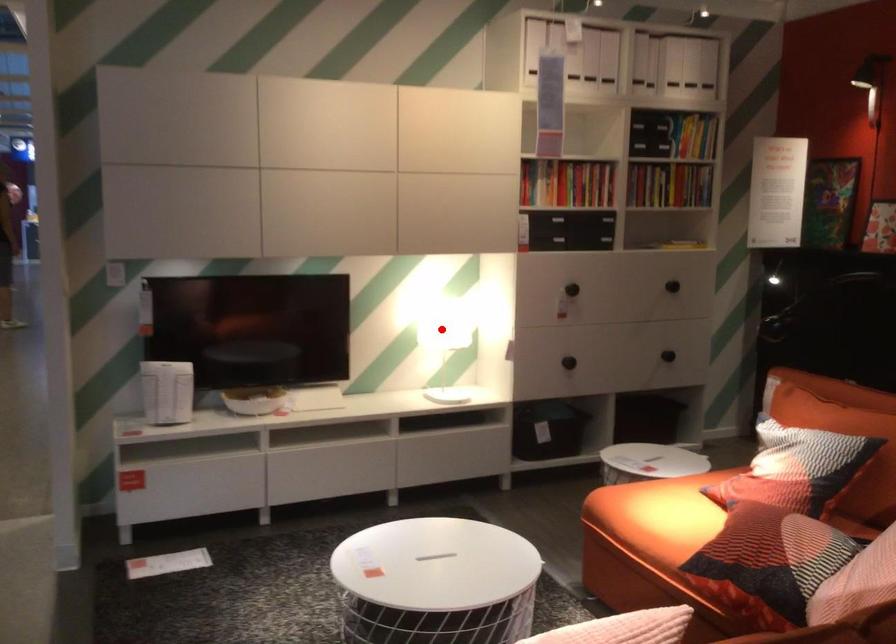
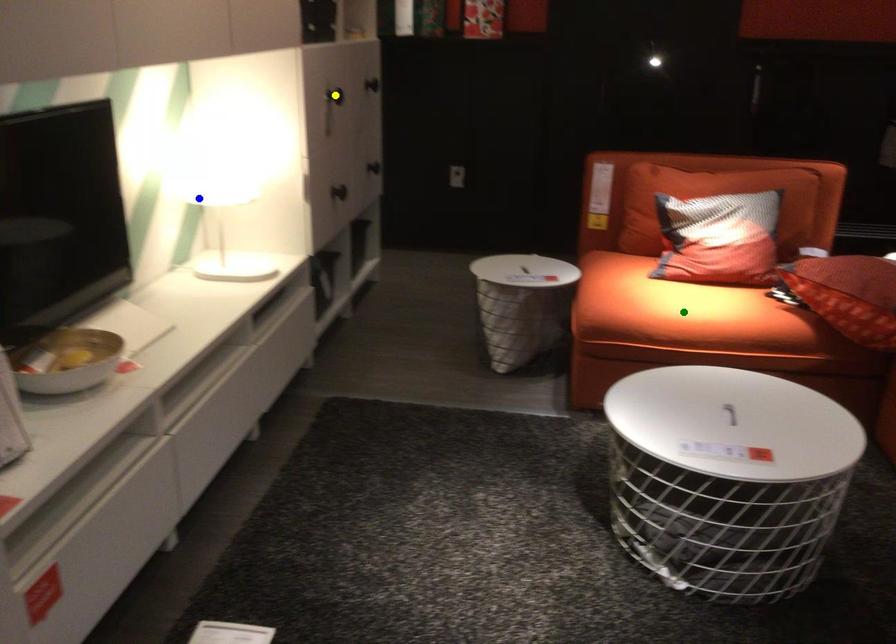
Question: I am providing you with two images of the same scene from different viewpoints. A red point is marked on the first image. You are given multiple points on the second image. Can you choose the point in image 2 that corresponds to the point in image 1?

Choices:
 (A) blue point
 (B) green point
 (C) yellow point

Answer: (A)